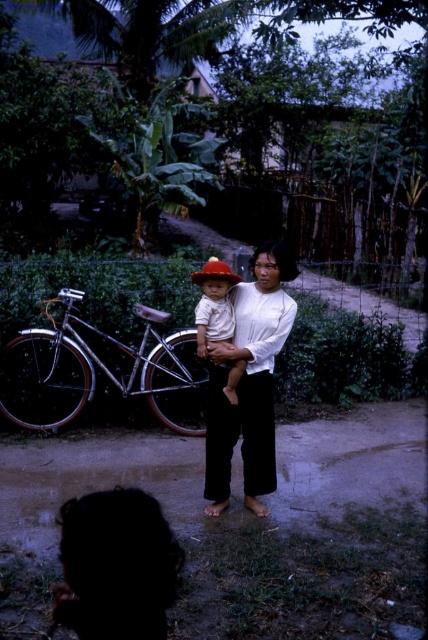
You are a photographer taking a picture of the silky black hair at lower left and the white cotton shirt at center. Which object should you focus on first if you want to capture both in the frame without moving the camera?

The silky black hair at lower left should be focused on first because it is positioned on the left side of the white cotton shirt at center, so adjusting focus starting from the left ensures both are in the frame.

You are a photographer trying to capture a portrait of the woman and the child. You notice the silky black hair at lower left and the white cotton shirt at center. Which object should you adjust your camera focus to ensure the subject is in focus, considering their sizes?

The silky black hair at lower left is wider than the white cotton shirt at center, so you should focus on the silky black hair at lower left as it is larger and likely closer to the camera.

You are standing at the point labeled point [220,262] and want to walk towards the point labeled point [220,456]. Which direction should you face to move towards it?

You should face towards the direction of point [220,456] because it is behind point [220,262].